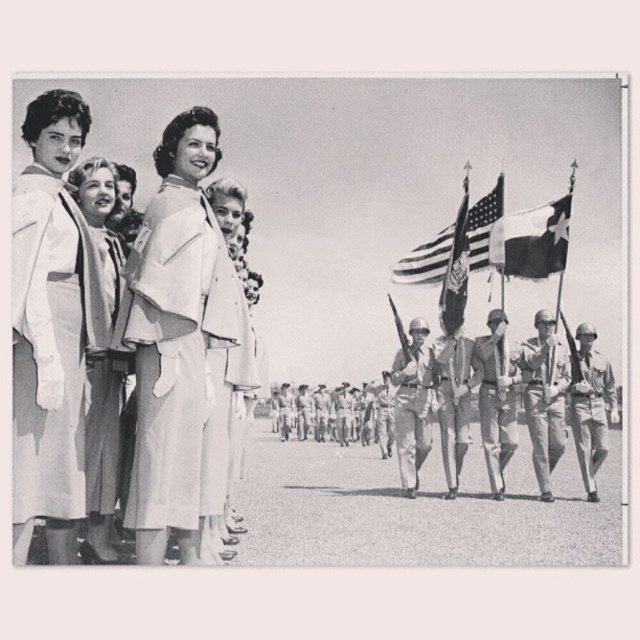
Is light beige fabric dress at center to the left of camouflage fabric uniform at center from the viewer's perspective?

Yes, light beige fabric dress at center is to the left of camouflage fabric uniform at center.

Can you confirm if light beige fabric dress at center is thinner than camouflage fabric uniform at center?

Yes.

Does point (234, 420) come closer to viewer compared to point (547, 369)?

Yes, it is in front of point (547, 369).

Locate an element on the screen. The image size is (640, 640). light beige fabric dress at center is located at coordinates (227, 381).

Which is behind, point (86, 522) or point (561, 397)?

Point (561, 397)

Which is more to the left, silky white dress at center or camouflage fabric uniform at center?

silky white dress at center

Is point (113, 179) positioned in front of point (545, 332)?

That is True.

Locate an element on the screen. silky white dress at center is located at coordinates (102, 454).

Is white fabric dress at left to the right of light beige fabric dress at center from the viewer's perspective?

Incorrect, white fabric dress at left is not on the right side of light beige fabric dress at center.

Is point (19, 413) positioned after point (220, 356)?

No, (19, 413) is in front of (220, 356).

Between point (13, 324) and point (221, 516), which one is positioned in front?

Point (13, 324) is in front.

The width and height of the screenshot is (640, 640). Identify the location of white fabric dress at left. (51, 346).